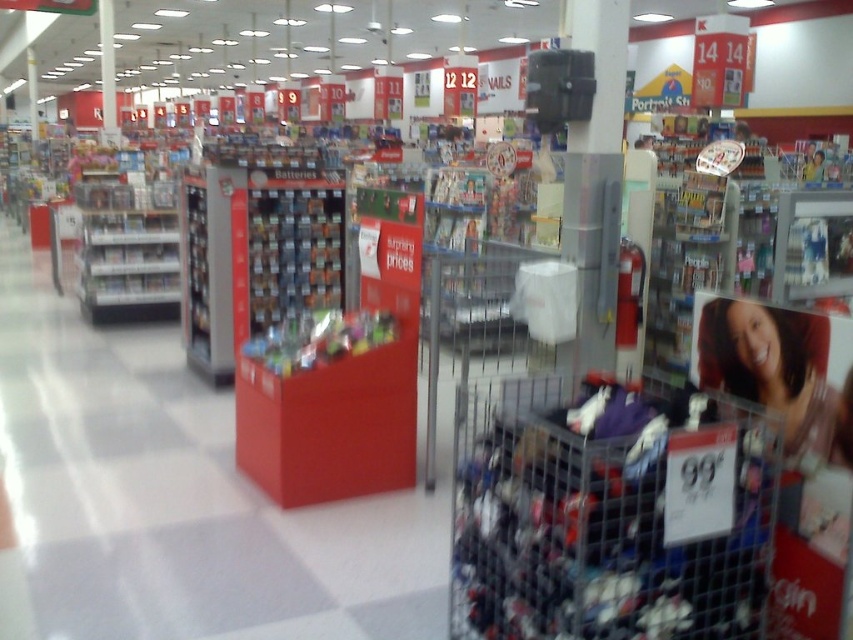
You are a customer in the store and want to place an item from the metallic silver shopping cart at lower right onto the smooth plastic photo at center. Is this possible based on their positions?

The metallic silver shopping cart at lower right is positioned on the left side of the smooth plastic photo at center, so you can place the item from the metallic silver shopping cart at lower right onto the smooth plastic photo at center since they are adjacent.

You are a customer in the store and want to place the metallic silver shopping cart at lower right on top of the smooth plastic photo at center. Is this possible based on their sizes?

The metallic silver shopping cart at lower right is much taller than the smooth plastic photo at center, so placing the metallic silver shopping cart at lower right on top of the smooth plastic photo at center would not be possible due to the height difference.

You are a store employee trying to move the metallic silver shopping cart at lower right to the storage area behind the smooth plastic photo at center. Can you fit the cart through the space between the photo and the wall?

The metallic silver shopping cart at lower right might be wider than smooth plastic photo at center, so there is a possibility that it won not fit through the space between the photo and the wall. Check the width before attempting to move it.